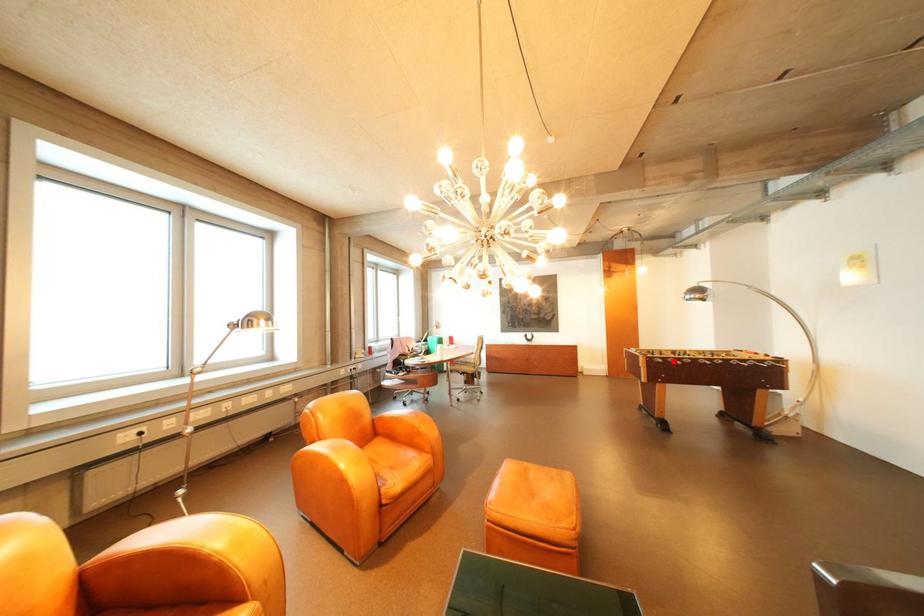
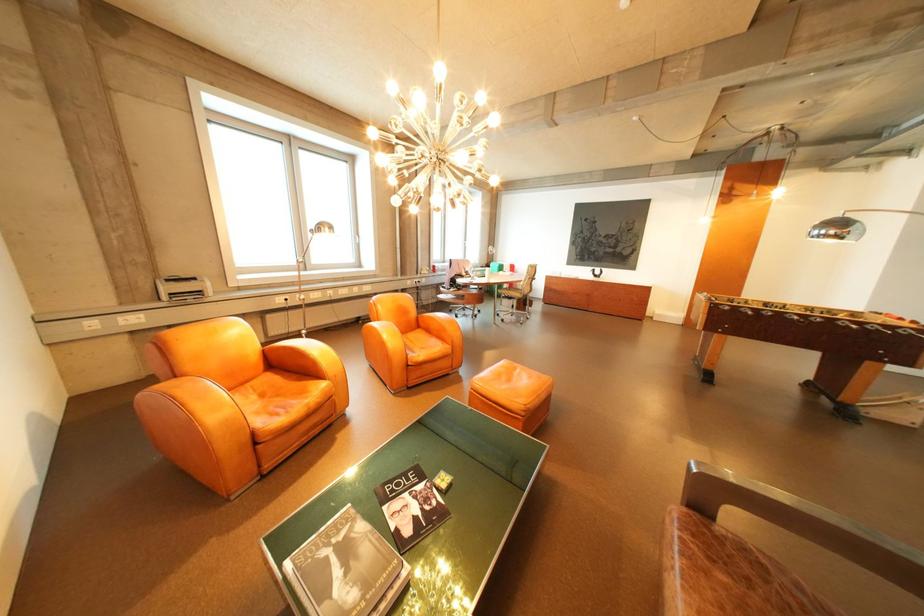
Locate, in the second image, the point that corresponds to the highlighted location in the first image.

(740, 309)